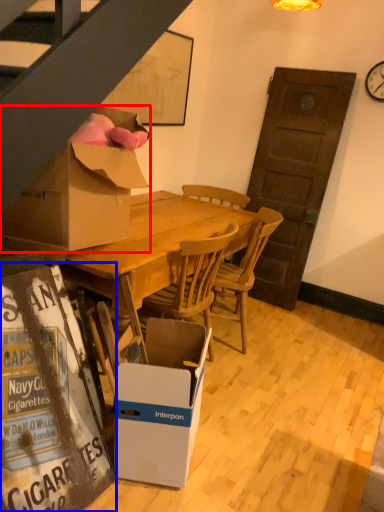
Question: Which point is further to the camera, box (highlighted by a red box) or bulletin board (highlighted by a blue box)?

Choices:
 (A) box
 (B) bulletin board

Answer: (A)